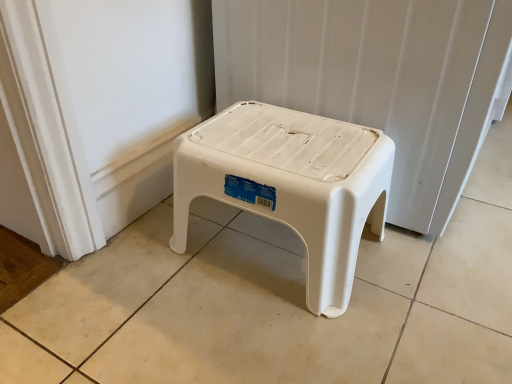
At what (x,y) coordinates should I click in order to perform the action: click on free space in front of white plastic stool at center. Please return your answer as a coordinate pair (x, y). The height and width of the screenshot is (384, 512). Looking at the image, I should click on (279, 339).